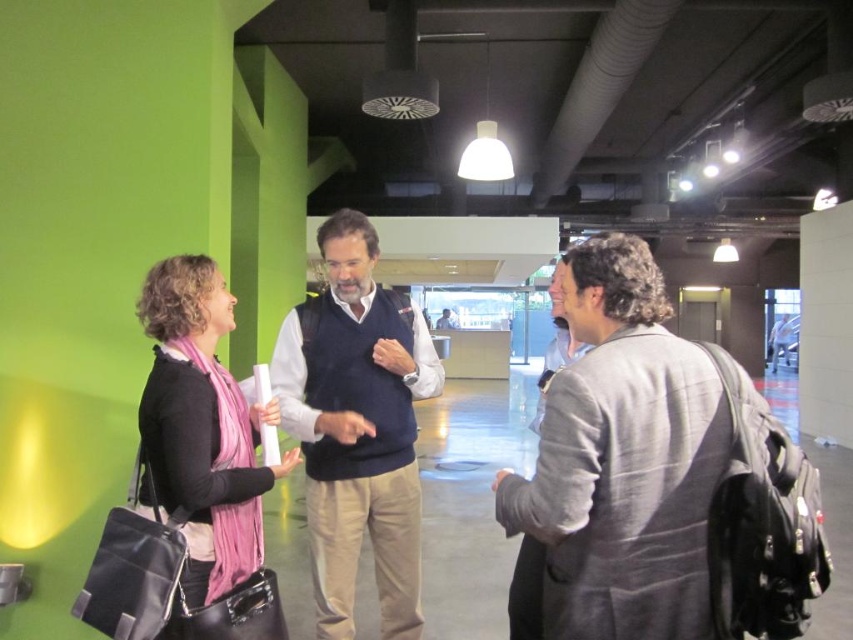
Question: Which of the following is the farthest from the observer?

Choices:
 (A) click(318, 481)
 (B) click(180, 349)
 (C) click(636, 484)

Answer: (A)

Question: Is dark blue sweater vest at center wider than pink scarf at left?

Choices:
 (A) yes
 (B) no

Answer: (A)

Question: Which point is closer to the camera?

Choices:
 (A) (397, 358)
 (B) (206, 371)
 (C) (680, 595)

Answer: (C)

Question: Can you confirm if gray woolen blazer at right is thinner than pink scarf at left?

Choices:
 (A) no
 (B) yes

Answer: (A)

Question: Observing the image, what is the correct spatial positioning of gray woolen blazer at right in reference to pink scarf at left?

Choices:
 (A) above
 (B) below

Answer: (A)

Question: Among these points, which one is nearest to the camera?

Choices:
 (A) (634, 582)
 (B) (235, 394)
 (C) (329, 387)

Answer: (A)